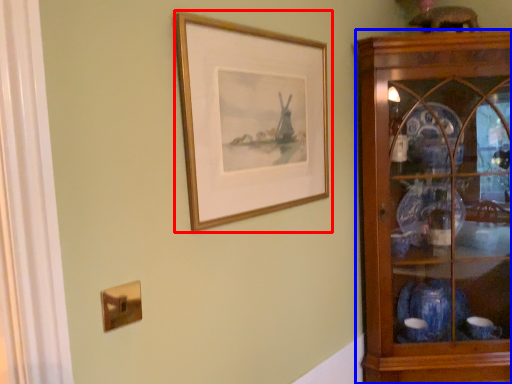
Question: Which point is closer to the camera, picture frame (highlighted by a red box) or shelf (highlighted by a blue box)?

Choices:
 (A) picture frame
 (B) shelf

Answer: (A)